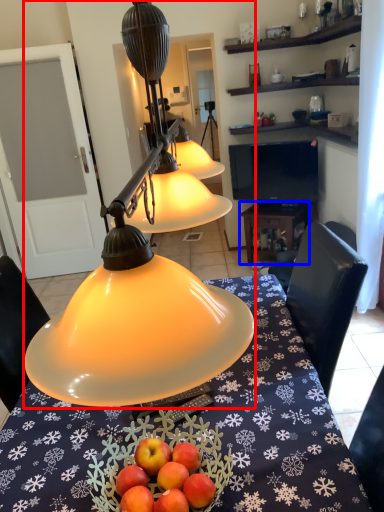
Question: Among these objects, which one is nearest to the camera, lamp (highlighted by a red box) or table (highlighted by a blue box)?

Choices:
 (A) lamp
 (B) table

Answer: (A)